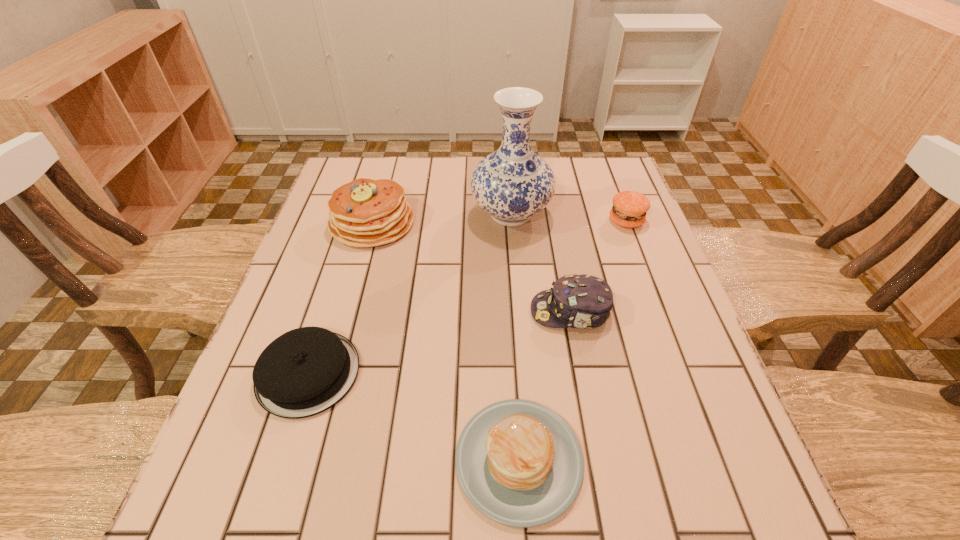
At what (x,y) coordinates should I click in order to perform the action: click on vacant region at the left edge of the desktop. Please return your answer as a coordinate pair (x, y). Looking at the image, I should click on (246, 455).

Image resolution: width=960 pixels, height=540 pixels. What are the coordinates of `blank space at the right edge of the desktop` in the screenshot? It's located at (666, 274).

Where is `vacant space at the far right corner`? vacant space at the far right corner is located at coordinates (575, 174).

What are the coordinates of `vacant space at the near right corner of the desktop` in the screenshot? It's located at (706, 504).

Identify the location of blank region between the vase and the second tallest object. (442, 219).

Locate an element on the screen. The width and height of the screenshot is (960, 540). free spot between the rightmost object and the vase is located at coordinates (568, 218).

Find the location of a particular element. The image size is (960, 540). vacant region between the rightmost object and the headwear is located at coordinates (598, 266).

The height and width of the screenshot is (540, 960). I want to click on vacant space that's between the headwear and the second tallest object, so click(x=471, y=267).

Where is `vacant region between the vase and the farthest pancake`? vacant region between the vase and the farthest pancake is located at coordinates (442, 219).

Locate an element on the screen. The width and height of the screenshot is (960, 540). unoccupied position between the headwear and the rightmost object is located at coordinates (598, 266).